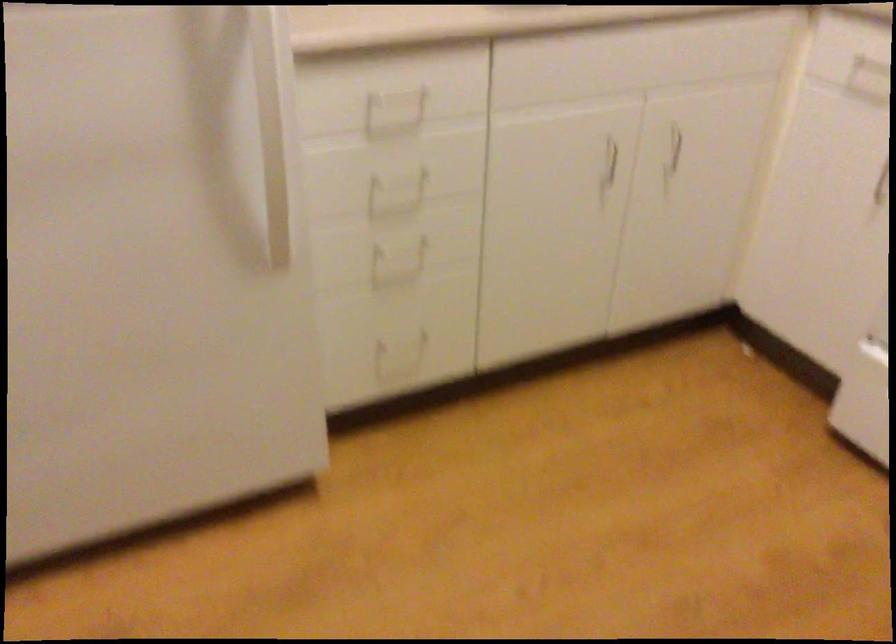
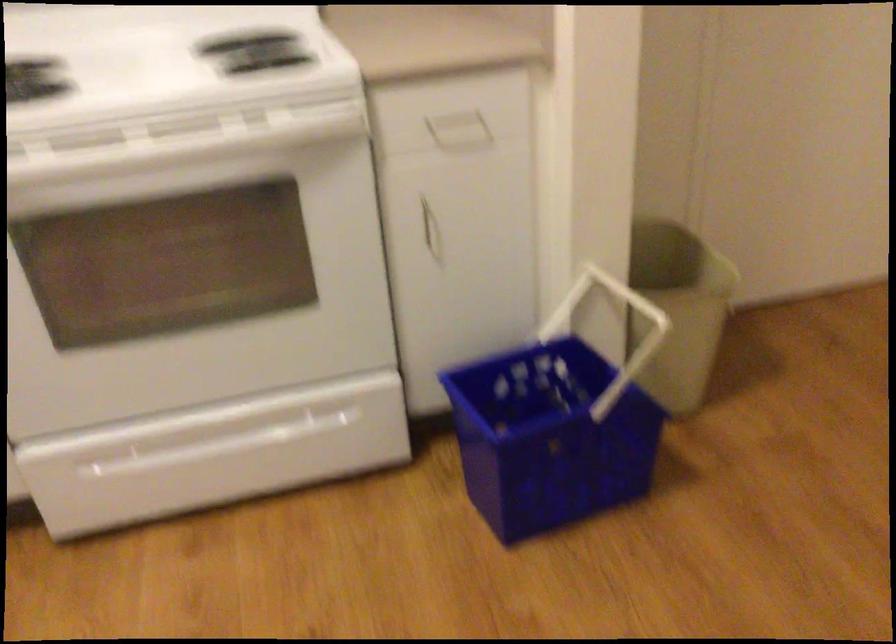
Based on the continuous images, in which direction is the camera rotating?

The rotation direction of the camera is right-down.